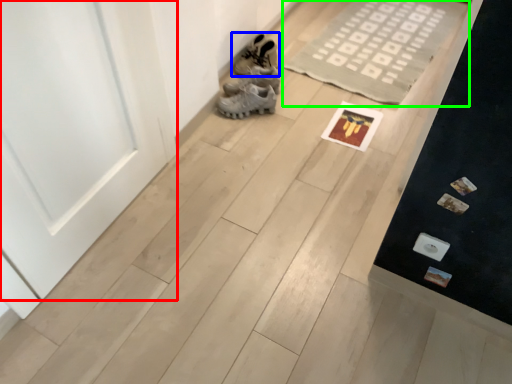
Question: Which object is the closest to the door (highlighted by a red box)? Choose among these: footwear (highlighted by a blue box) or doormat (highlighted by a green box).

Choices:
 (A) footwear
 (B) doormat

Answer: (A)